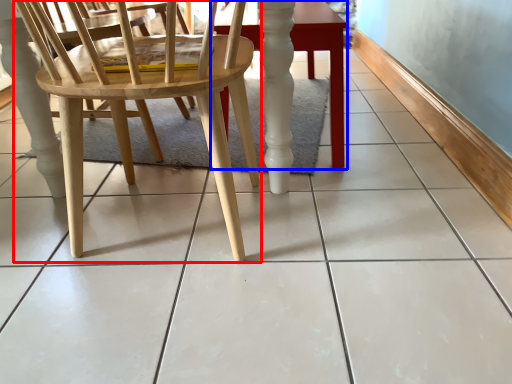
Question: Which point is closer to the camera, chair (highlighted by a red box) or table (highlighted by a blue box)?

Choices:
 (A) chair
 (B) table

Answer: (A)